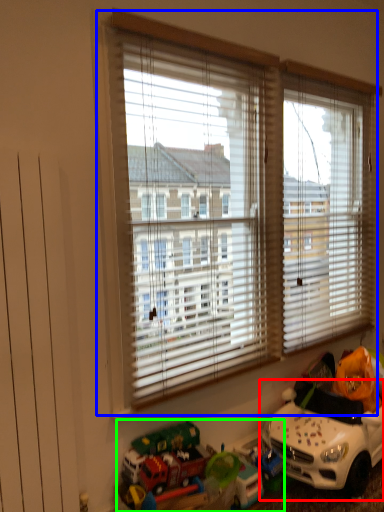
Question: Which object is the closest to the toy (highlighted by a red box)? Choose among these: window (highlighted by a blue box) or toy (highlighted by a green box).

Choices:
 (A) window
 (B) toy

Answer: (B)